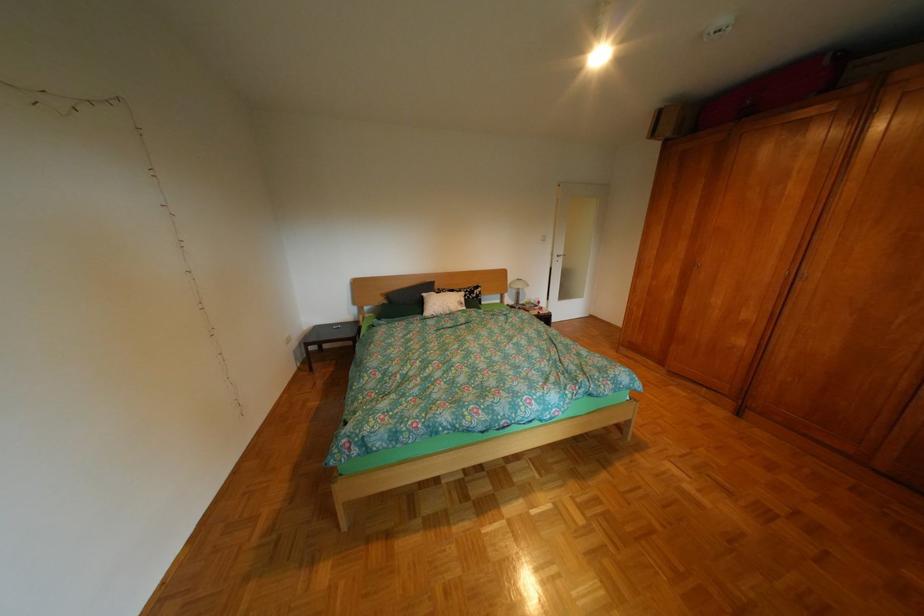
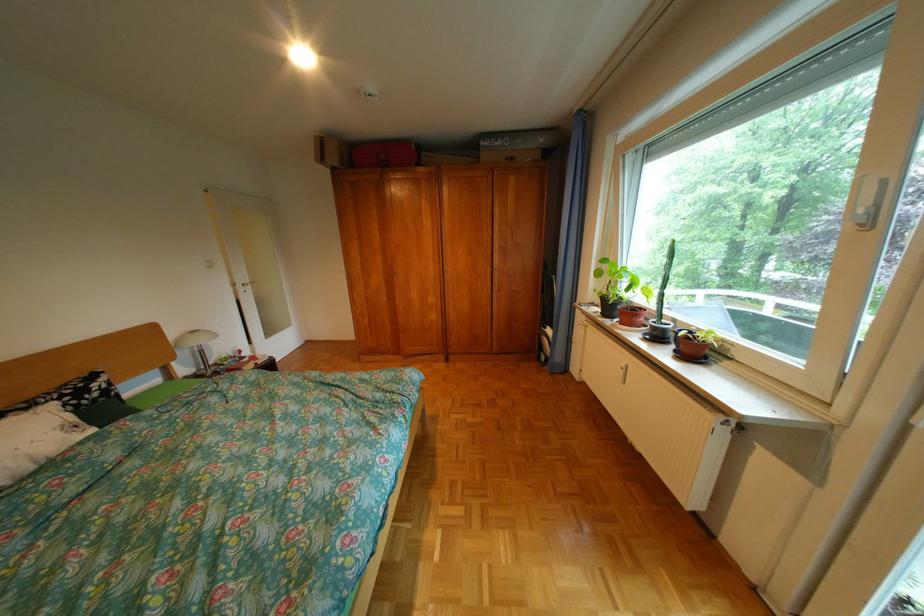
Locate, in the second image, the point that corresponds to [687,270] in the first image.

(392, 280)